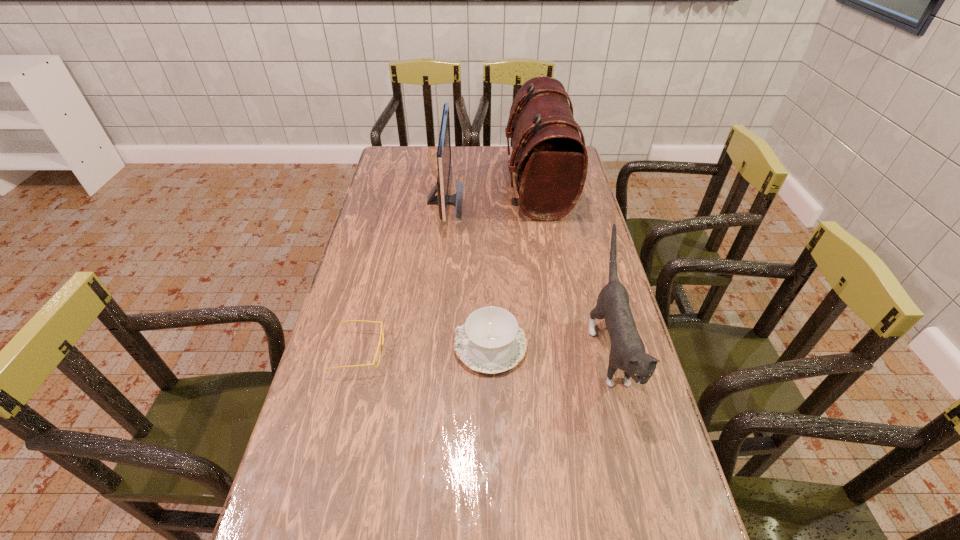
Where is `vacant space located at the face of the cat`? vacant space located at the face of the cat is located at coordinates (635, 444).

This screenshot has width=960, height=540. Identify the location of vacant space located 0.170m on the handle side of the chinaware. (391, 345).

You are a GUI agent. You are given a task and a screenshot of the screen. Output one action in this format:
    pyautogui.click(x=<x>, y=<y>)
    Task: Click on the vacant space located on the handle side of the chinaware
    The width and height of the screenshot is (960, 540).
    Given the screenshot: What is the action you would take?
    pyautogui.click(x=417, y=345)

Where is `vacant space located 0.180m on the handle side of the chinaware`? This screenshot has width=960, height=540. vacant space located 0.180m on the handle side of the chinaware is located at coordinates (387, 345).

Find the location of a particular element. The width and height of the screenshot is (960, 540). vacant space located 0.370m in front of the lenses of the spectacles is located at coordinates (522, 352).

Identify the location of satchel at the far edge. (549, 158).

This screenshot has height=540, width=960. In order to click on monitor that is at the far edge in this screenshot , I will do `click(442, 199)`.

Find the location of `object that is at the left edge`. object that is at the left edge is located at coordinates (380, 343).

The width and height of the screenshot is (960, 540). I want to click on satchel located at the right edge, so click(549, 158).

You are a GUI agent. You are given a task and a screenshot of the screen. Output one action in this format:
    pyautogui.click(x=<x>, y=<y>)
    Task: Click on the cat at the right edge
    
    Given the screenshot: What is the action you would take?
    pyautogui.click(x=627, y=353)